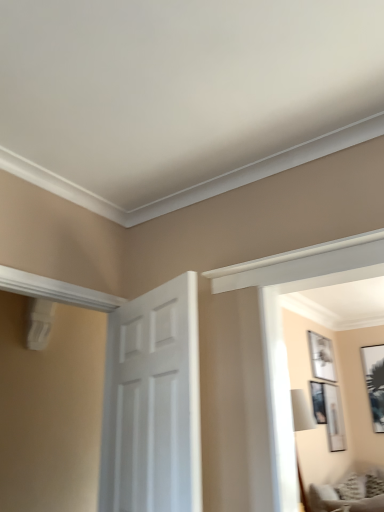
Question: Is white matte picture frame at upper right, the third picture frame from the right, to the left or to the right of textured gray sofa at lower right in the image?

Choices:
 (A) left
 (B) right

Answer: (B)

Question: From the image's perspective, is white matte picture frame at upper right, placed as the second picture frame when sorted from left to right, above or below textured gray sofa at lower right?

Choices:
 (A) below
 (B) above

Answer: (B)

Question: Which object is the closest to the white matte picture frame at upper right, the third picture frame from the right?

Choices:
 (A) textured gray sofa at lower right
 (B) white matte door at center
 (C) matte black picture frame at upper right, acting as the 1th picture frame starting from the left
 (D) matte black picture frame at upper right, the 3th picture frame viewed from the left
 (E) black glossy picture frame at upper right, the 4th picture frame when ordered from left to right

Answer: (C)

Question: Which is farther from the matte black picture frame at upper right, positioned as the 2th picture frame in right-to-left order?

Choices:
 (A) white matte picture frame at upper right, placed as the second picture frame when sorted from left to right
 (B) matte black picture frame at upper right, which is counted as the fourth picture frame, starting from the right
 (C) white matte door at center
 (D) textured gray sofa at lower right
 (E) black glossy picture frame at upper right, the 4th picture frame when ordered from left to right

Answer: (C)